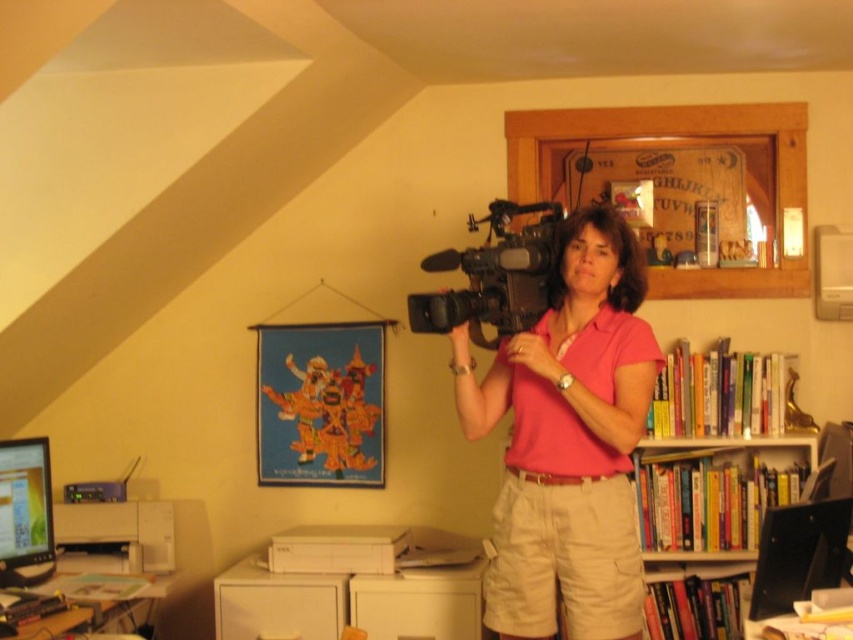
You are standing in a home office and want to film a video. The camera is at point (430, 323). If you need to be 2 meters away from the camera to film properly, can you film from where you are?

The distance between you and the camera at point (430, 323) is 2.16 meters, which is slightly more than the required 2 meters. Therefore, you can film from your current position as it meets the distance requirement.

Consider the image. You are standing in the home office and want to place a small plant between the two points, point [686,561] and point [509,241]. Which point should the plant be closer to so it appears closer to you?

The plant should be closer to point [509,241] because point [686,561] is further away from the viewer, so placing it near the closer point would make it appear nearer.